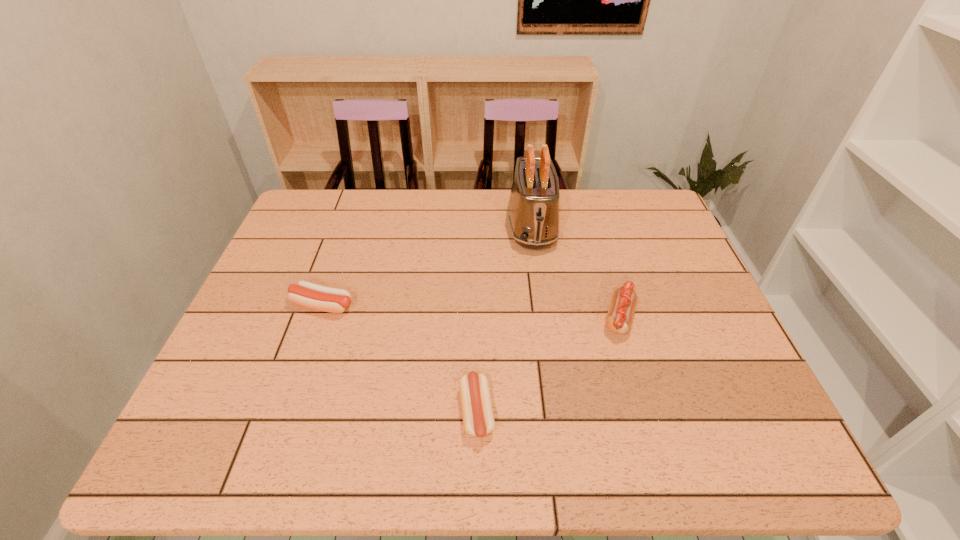
In order to click on vacant point located 0.070m on the back of the second sausage from right to left in this screenshot , I will do `click(477, 356)`.

Locate an element on the screen. Image resolution: width=960 pixels, height=540 pixels. object that is at the far edge is located at coordinates (533, 212).

Identify the location of object at the near edge. The image size is (960, 540). (478, 419).

I want to click on object that is at the left edge, so click(x=334, y=300).

Where is `vacant area at the far edge`? vacant area at the far edge is located at coordinates (502, 190).

At what (x,y) coordinates should I click in order to perform the action: click on free region at the near edge. Please return your answer as a coordinate pair (x, y). Looking at the image, I should click on pyautogui.click(x=384, y=454).

Identify the location of free location at the left edge. Image resolution: width=960 pixels, height=540 pixels. (283, 255).

Locate an element on the screen. blank space at the right edge is located at coordinates (660, 262).

In the image, there is a desktop. Where is `vacant area at the far right corner`? vacant area at the far right corner is located at coordinates (659, 205).

Locate an element on the screen. Image resolution: width=960 pixels, height=540 pixels. vacant space that is in between the toaster and the leftmost sausage is located at coordinates (427, 266).